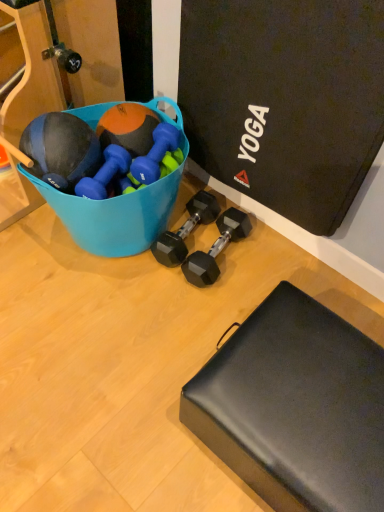
Where is `free spot to the right of black rubber dumbbell at center, which ranks as the third dumbbell in left-to-right order`? This screenshot has height=512, width=384. free spot to the right of black rubber dumbbell at center, which ranks as the third dumbbell in left-to-right order is located at coordinates (256, 247).